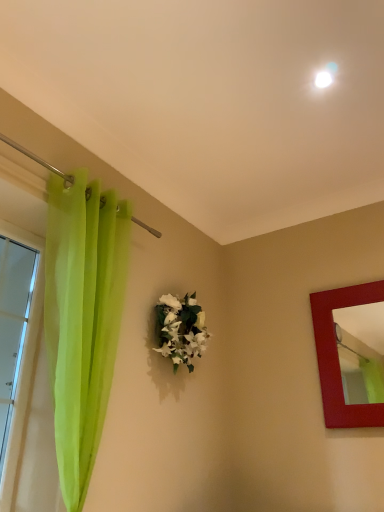
What do you see at coordinates (337, 355) in the screenshot?
I see `matte red picture frame at right` at bounding box center [337, 355].

This screenshot has height=512, width=384. Describe the element at coordinates (17, 336) in the screenshot. I see `transparent green curtain at left` at that location.

I want to click on white matte floral arrangement at center, so click(181, 329).

Image resolution: width=384 pixels, height=512 pixels. In order to click on matte red picture frame at right in this screenshot , I will do `click(337, 355)`.

Which of these two, matte red picture frame at right or white matte floral arrangement at center, stands taller?

matte red picture frame at right is taller.

From the image's perspective, does matte red picture frame at right appear higher than white matte floral arrangement at center?

No.

Considering the sizes of objects matte red picture frame at right and white matte floral arrangement at center in the image provided, who is bigger, matte red picture frame at right or white matte floral arrangement at center?

matte red picture frame at right is bigger.

Looking at this image, which object is further away from the camera, matte red picture frame at right or white matte floral arrangement at center?

matte red picture frame at right is more distant.

From the image's perspective, is white matte floral arrangement at center above or below matte red picture frame at right?

white matte floral arrangement at center is situated higher than matte red picture frame at right in the image.

Which is less distant, [180,304] or [379,294]?

The point [379,294] is in front.

Is white matte floral arrangement at center inside or outside of matte red picture frame at right?

white matte floral arrangement at center exists outside the volume of matte red picture frame at right.

Which object is further away from the camera, white matte floral arrangement at center or matte red picture frame at right?

Positioned behind is matte red picture frame at right.

Could you tell me if transparent green curtain at left is facing matte red picture frame at right?

No, transparent green curtain at left is not oriented towards matte red picture frame at right.

This screenshot has height=512, width=384. I want to click on window above the matte red picture frame at right (from the image's perspective), so click(x=17, y=336).

Does point (30, 237) come farther from viewer compared to point (362, 406)?

No.

Looking at this image, between matte red picture frame at right and transparent green curtain at left, which one is positioned behind?

matte red picture frame at right is further away from the camera.

Considering the relative sizes of matte red picture frame at right and transparent green curtain at left in the image provided, is matte red picture frame at right shorter than transparent green curtain at left?

Indeed, matte red picture frame at right has a lesser height compared to transparent green curtain at left.

Would you say matte red picture frame at right is a long distance from transparent green curtain at left?

Yes, matte red picture frame at right and transparent green curtain at left are located far from each other.

Is white matte floral arrangement at center taller or shorter than transparent green curtain at left?

Considering their sizes, white matte floral arrangement at center has less height than transparent green curtain at left.

Between white matte floral arrangement at center and transparent green curtain at left, which one is positioned behind?

white matte floral arrangement at center is more distant.

Which is closer to the camera, (170, 314) or (25, 349)?

Point (170, 314) is farther from the camera than point (25, 349).

From a real-world perspective, who is located higher, white matte floral arrangement at center or transparent green curtain at left?

white matte floral arrangement at center is physically above.

Between transparent green curtain at left and white matte floral arrangement at center, which one has less height?

white matte floral arrangement at center.

Could you tell me if transparent green curtain at left is facing white matte floral arrangement at center?

No, transparent green curtain at left is not aimed at white matte floral arrangement at center.

Is transparent green curtain at left completely or partially outside of white matte floral arrangement at center?

Yes, transparent green curtain at left is not within white matte floral arrangement at center.

At what (x,y) coordinates should I click in order to perform the action: click on picture frame below the white matte floral arrangement at center (from a real-world perspective). Please return your answer as a coordinate pair (x, y). Looking at the image, I should click on [337, 355].

Identify the location of flower above the matte red picture frame at right (from a real-world perspective). The width and height of the screenshot is (384, 512). (181, 329).

From the image, which object appears to be nearer to matte red picture frame at right, transparent green curtain at left or white matte floral arrangement at center?

white matte floral arrangement at center lies closer to matte red picture frame at right than the other object.

Considering their positions, is matte red picture frame at right positioned closer to white matte floral arrangement at center than transparent green curtain at left?

Based on the image, matte red picture frame at right appears to be nearer to white matte floral arrangement at center.

Looking at the image, which one is located further to matte red picture frame at right, white matte floral arrangement at center or transparent green curtain at left?

transparent green curtain at left.

When comparing their distances from transparent green curtain at left, does white matte floral arrangement at center or matte red picture frame at right seem further?

Based on the image, matte red picture frame at right appears to be further to transparent green curtain at left.

Looking at the image, which one is located further to transparent green curtain at left, matte red picture frame at right or white matte floral arrangement at center?

matte red picture frame at right lies further to transparent green curtain at left than the other object.

Estimate the real-world distances between objects in this image. Which object is closer to white matte floral arrangement at center, transparent green curtain at left or matte red picture frame at right?

Based on the image, matte red picture frame at right appears to be nearer to white matte floral arrangement at center.

At what (x,y) coordinates should I click in order to perform the action: click on flower located between transparent green curtain at left and matte red picture frame at right in the left-right direction. Please return your answer as a coordinate pair (x, y). Image resolution: width=384 pixels, height=512 pixels. Looking at the image, I should click on (181, 329).